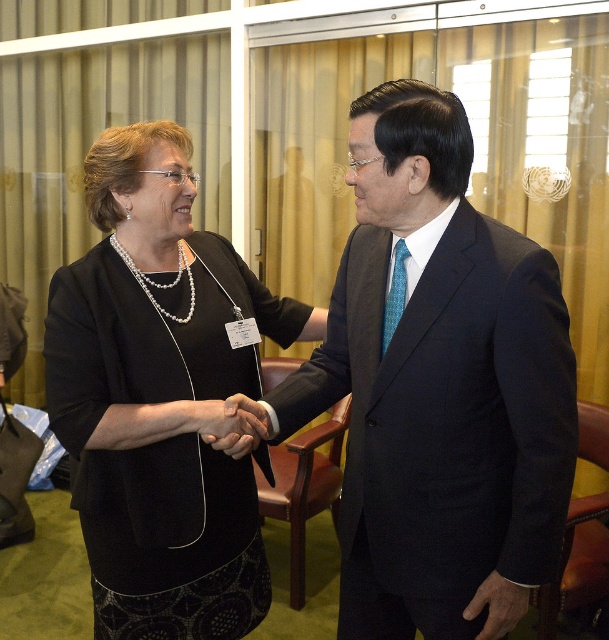
You are an event planner observing a formal meeting between two people. You notice the matte black suit at center and the smooth skin handshake at center. Which object is positioned higher in the image?

The matte black suit at center is taller than the smooth skin handshake at center, so the matte black suit at center is positioned higher in the image.

You are a photographer in the conference room. You want to capture a closeup of the smooth skin handshake at center. Based on the coordinates provided, where exactly should you focus your camera lens?

The smooth skin handshake at center is located at coordinates point (236, 424), so you should focus your camera lens there.

You are an event planner organizing a formal event and need to arrange seating for two guests. The guests are wearing the matte black suit at center and the smooth skin handshake at center. Based on their positions in the image, which guest should be seated to the right of the handshake during the event?

The matte black suit at center is positioned on the right side of the smooth skin handshake at center, so the guest in the matte black suit at center should be seated to the right of the handshake during the event.